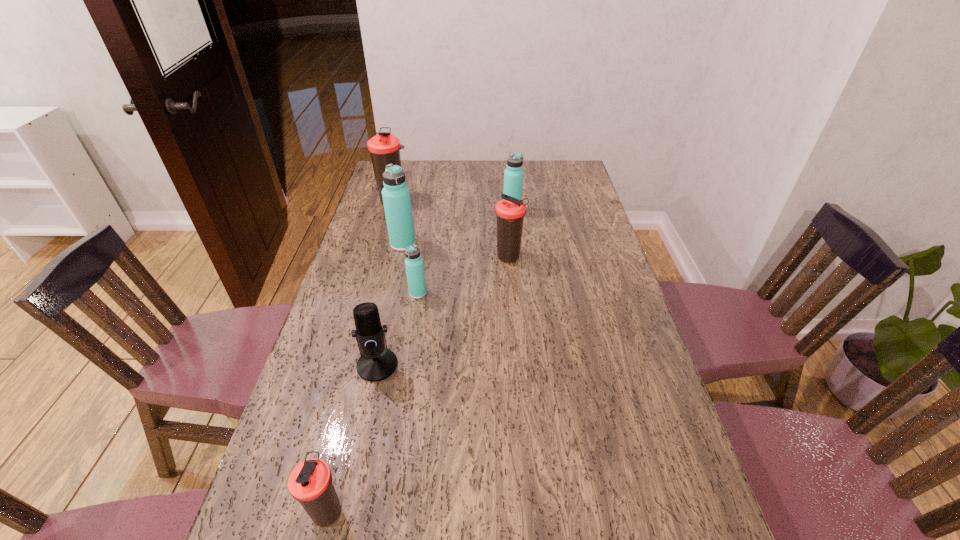
Identify the location of empty space that is in between the farthest brown thermos bottle and the microphone. The height and width of the screenshot is (540, 960). (386, 282).

Locate an element on the screen. This screenshot has width=960, height=540. object that is the third closest one to the second smallest brown thermos bottle is located at coordinates (396, 195).

Identify which object is the third nearest to the microphone. Please provide its 2D coordinates. Your answer should be formatted as a tuple, i.e. [(x, y)], where the tuple contains the x and y coordinates of a point satisfying the conditions above.

[(396, 195)]

You are a GUI agent. You are given a task and a screenshot of the screen. Output one action in this format:
    pyautogui.click(x=<x>, y=<y>)
    Task: Click on the fifth closest thermos bottle to the leftmost aqua thermos bottle
    This screenshot has height=540, width=960.
    Given the screenshot: What is the action you would take?
    pyautogui.click(x=311, y=482)

Identify the location of the fifth closest thermos bottle to the black microphone. (384, 148).

In order to click on brown thermos bottle that is the second nearest to the rightmost aqua thermos bottle in this screenshot , I will do `click(384, 148)`.

Identify which brown thermos bottle is the nearest to the second smallest brown thermos bottle. Please provide its 2D coordinates. Your answer should be formatted as a tuple, i.e. [(x, y)], where the tuple contains the x and y coordinates of a point satisfying the conditions above.

[(384, 148)]

The height and width of the screenshot is (540, 960). In order to click on aqua thermos bottle object that ranks as the second closest to the farthest aqua thermos bottle in this screenshot , I will do `click(414, 265)`.

This screenshot has width=960, height=540. I want to click on aqua thermos bottle that can be found as the closest to the second farthest aqua thermos bottle, so coord(414,265).

Locate an element on the screen. The width and height of the screenshot is (960, 540). vacant space that satisfies the following two spatial constraints: 1. on the back side of the smallest brown thermos bottle; 2. on the right side of the rightmost aqua thermos bottle is located at coordinates (402, 212).